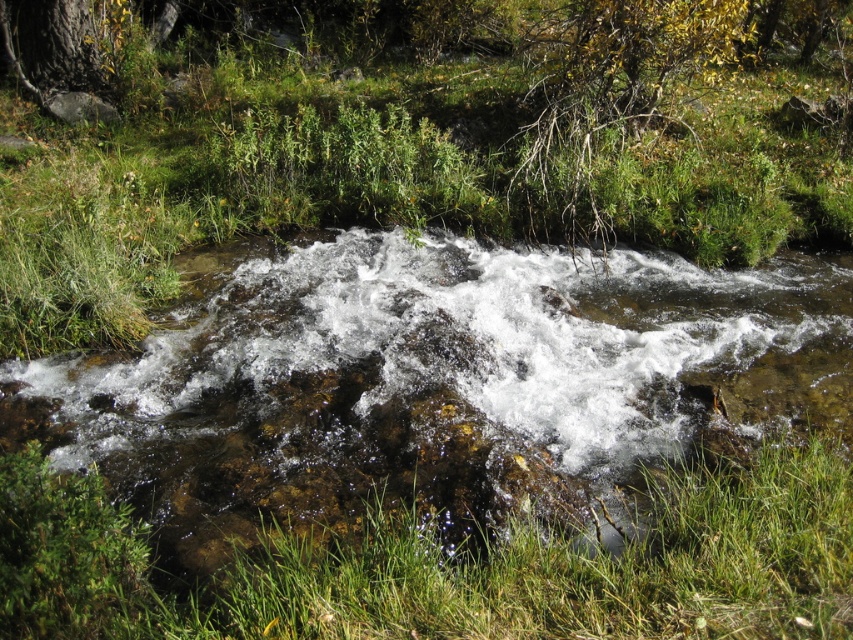
Question: Is clear water at center in front of green grass at center?

Choices:
 (A) yes
 (B) no

Answer: (B)

Question: Which object appears closest to the camera in this image?

Choices:
 (A) clear water at center
 (B) green grass at center

Answer: (B)

Question: Is clear water at center wider than green grass at center?

Choices:
 (A) no
 (B) yes

Answer: (B)

Question: Can you confirm if clear water at center is positioned to the left of green grass at center?

Choices:
 (A) yes
 (B) no

Answer: (A)